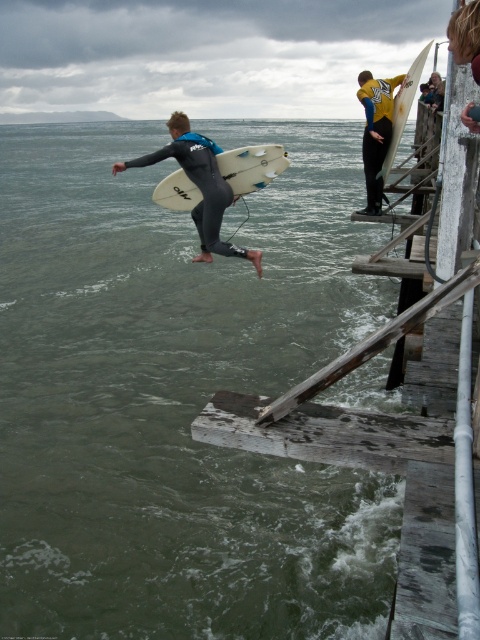
Does white matte surfboard at center have a smaller size compared to yellow matte wetsuit at upper right?

Yes.

Does white matte surfboard at center appear on the right side of yellow matte wetsuit at upper right?

In fact, white matte surfboard at center is to the left of yellow matte wetsuit at upper right.

Is point (168, 204) positioned behind point (367, 84)?

No, it is in front of (367, 84).

This screenshot has height=640, width=480. What are the coordinates of `white matte surfboard at center` in the screenshot? It's located at (251, 166).

Is matte black wetsuit at center wider than white matte surfboard at center?

No.

What do you see at coordinates (199, 186) in the screenshot? I see `matte black wetsuit at center` at bounding box center [199, 186].

Locate an element on the screen. The width and height of the screenshot is (480, 640). matte black wetsuit at center is located at coordinates (199, 186).

Between matte black wetsuit at center and yellow matte wetsuit at upper right, which one is positioned higher?

yellow matte wetsuit at upper right is above.

Which is behind, point (224, 209) or point (367, 188)?

Positioned behind is point (367, 188).

Locate an element on the screen. The image size is (480, 640). matte black wetsuit at center is located at coordinates (199, 186).